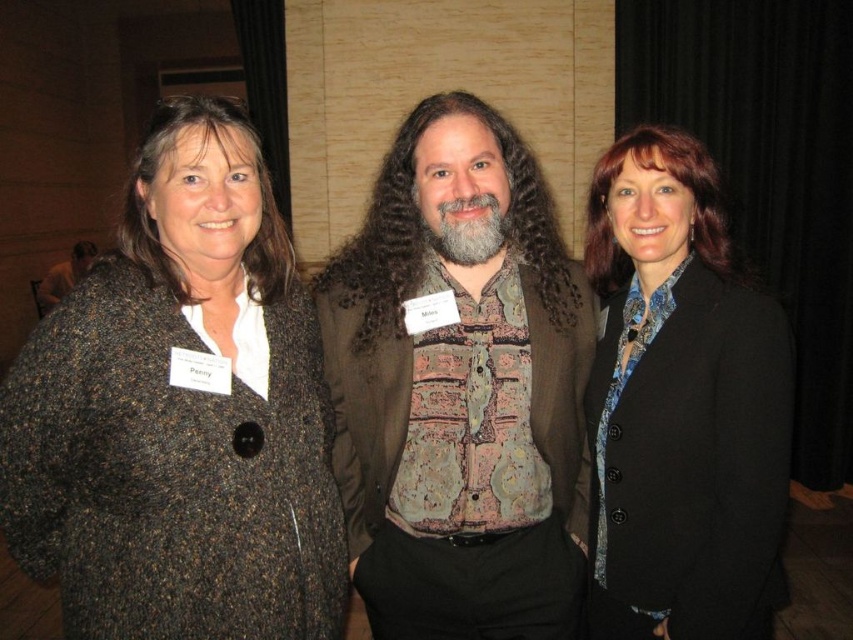
Where is the knitted brown coat at left located in the image?

The knitted brown coat at left is located at point (178, 413) in the image.

Based on the coordinates given, which object is located at point (178, 413)?

The point (178, 413) marks the knitted brown coat at left.